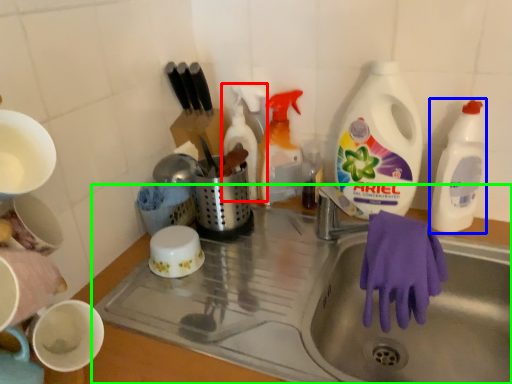
Question: Which object is the farthest from cleaning product (highlighted by a red box)? Choose among these: cleaning product (highlighted by a blue box) or sink (highlighted by a green box).

Choices:
 (A) cleaning product
 (B) sink

Answer: (A)